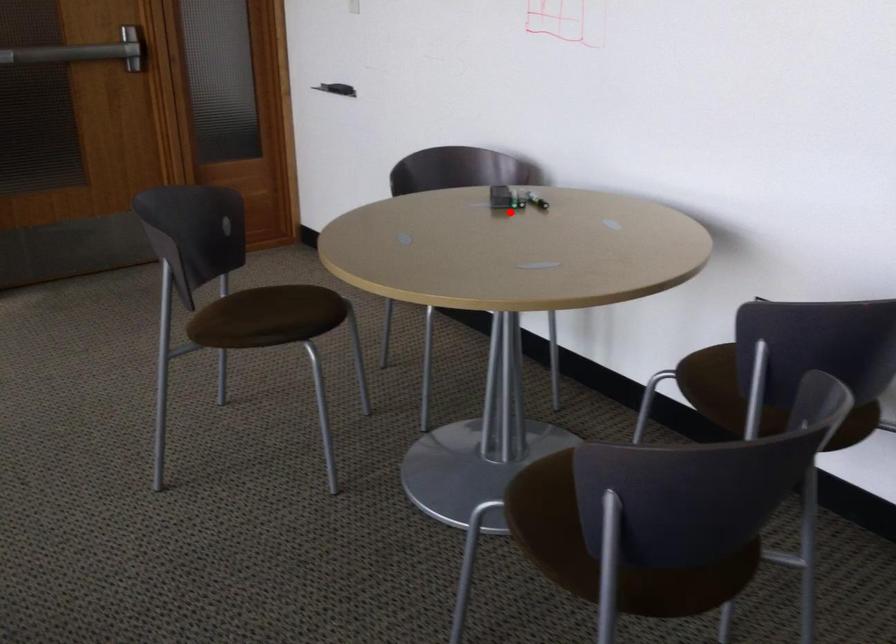
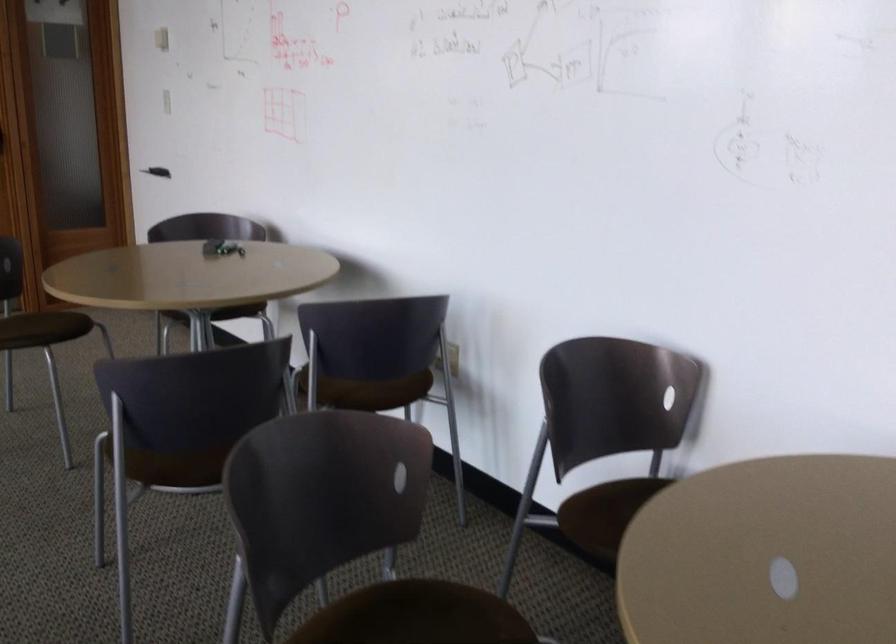
Find the pixel in the second image that matches the highlighted location in the first image.

(221, 248)